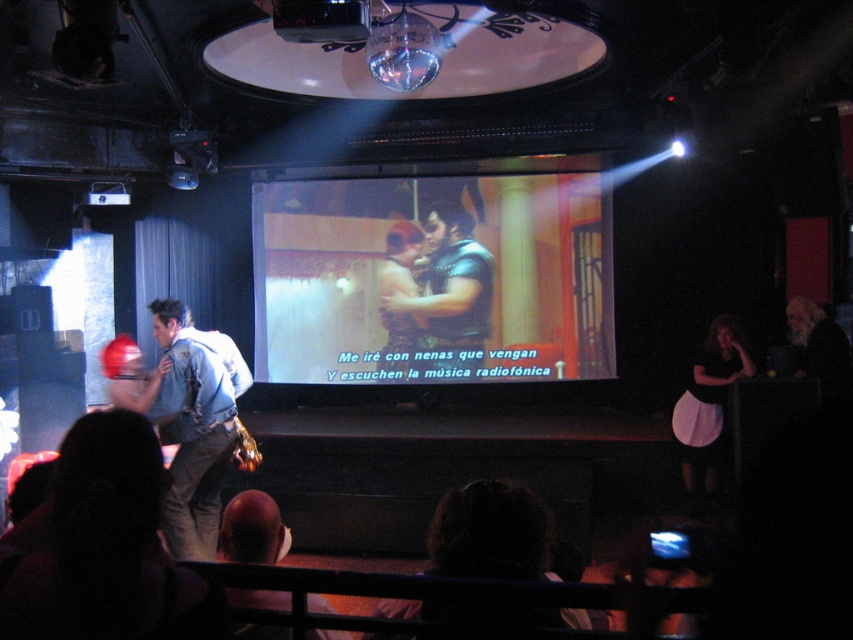
Question: Which object is farther from the camera taking this photo?

Choices:
 (A) matte black dress at center
 (B) black plastic projector at upper center

Answer: (A)

Question: Which point is closer to the camera?

Choices:
 (A) matte black screen at center
 (B) white cotton apron at lower right
 (C) denim jacket at center

Answer: (C)

Question: Is matte black dress at center positioned behind black plastic projector at upper center?

Choices:
 (A) no
 (B) yes

Answer: (B)

Question: Considering the relative positions of white cotton apron at lower right and smooth leather jacket at lower center in the image provided, where is white cotton apron at lower right located with respect to smooth leather jacket at lower center?

Choices:
 (A) below
 (B) above

Answer: (A)

Question: Can you confirm if denim jacket at center is positioned to the left of smooth leather jacket at lower center?

Choices:
 (A) yes
 (B) no

Answer: (A)

Question: Considering the real-world distances, which object is farthest from the smooth leather jacket at lower center?

Choices:
 (A) matte black dress at center
 (B) black plastic projector at upper center

Answer: (A)